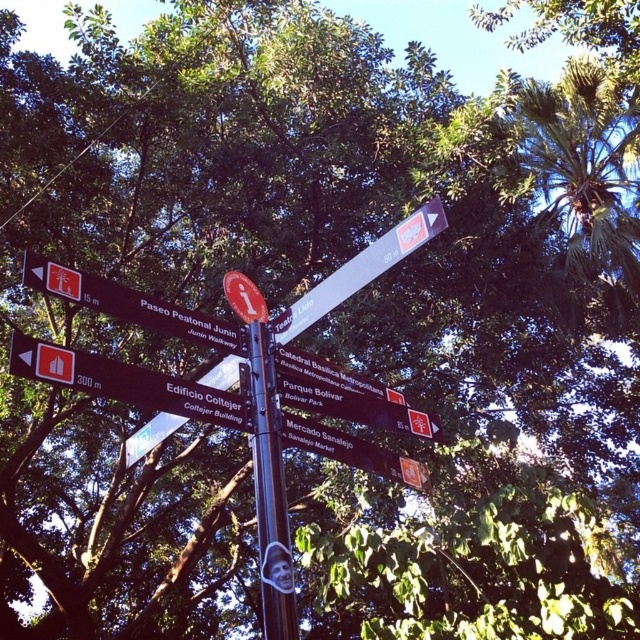
Question: Estimate the real-world distances between objects in this image. Which object is farther from the matte brown sign at lower left?

Choices:
 (A) matte red sign at center
 (B) brown wooden sign at center
 (C) white plastic sign at upper left
 (D) white plastic sign at upper center

Answer: (D)

Question: Which object appears farthest from the camera in this image?

Choices:
 (A) white plastic sign at upper center
 (B) matte red sign at center
 (C) matte brown sign at lower left
 (D) metallic pole at center

Answer: (B)

Question: Does matte brown sign at lower left come behind white plastic sign at upper left?

Choices:
 (A) yes
 (B) no

Answer: (B)

Question: Is white plastic sign at upper left above brown wooden sign at center?

Choices:
 (A) yes
 (B) no

Answer: (A)

Question: Which point is farther to the camera?

Choices:
 (A) matte red sign at center
 (B) matte brown sign at lower left
 (C) white plastic sign at upper left

Answer: (A)

Question: Can you confirm if matte brown sign at lower left is positioned below matte red sign at center?

Choices:
 (A) yes
 (B) no

Answer: (A)